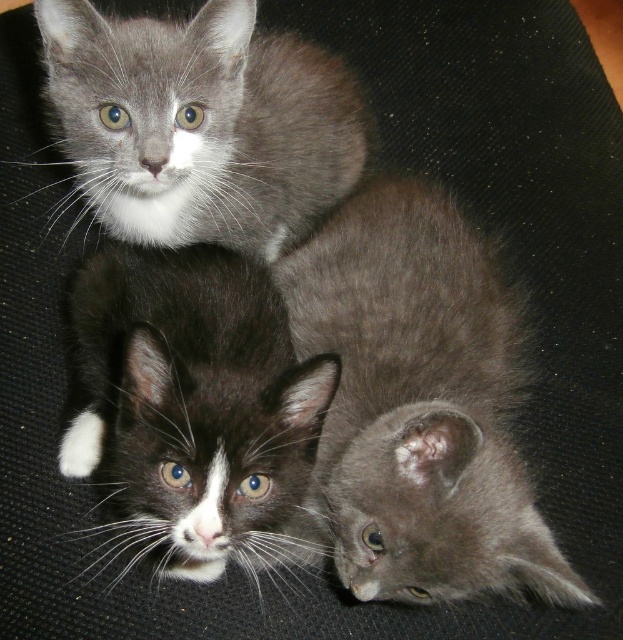
You are a photographer trying to capture the gray fluffy kitten at center. You notice that the camera focuses on the point at coordinates (416, 406). Is the gray fluffy kitten at center in focus?

Yes, the gray fluffy kitten at center is located at point (416, 406), so the camera focus is directly on it, meaning it should be in focus.

You are a photographer trying to capture the gray fluffy kitten at center and the gray fluffy kitten at upper left. Which kitten do you need to zoom in more on to fill the frame, considering their sizes?

The gray fluffy kitten at center has a lesser width compared to the gray fluffy kitten at upper left, so you need to zoom in more on the gray fluffy kitten at center to fill the frame because it is smaller in size.

You are a cat owner who wants to place a toy between the gray kitten at the top and the black and white fur cat at center. How far apart should you place the toy from each kitten to ensure it is exactly in the middle?

The toy should be placed 0.555 meters away from both the gray kitten at the top and the black and white fur cat at center to be exactly in the middle.